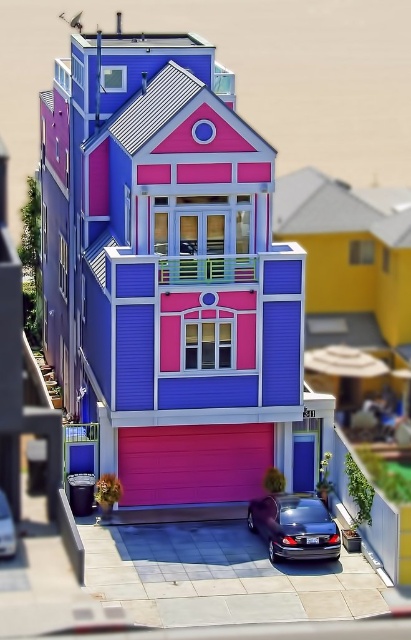
Who is taller, glossy metallic car at lower center or shiny metallic car at lower center?

glossy metallic car at lower center

Who is shorter, glossy metallic car at lower center or shiny metallic car at lower center?

With less height is shiny metallic car at lower center.

What do you see at coordinates (295, 525) in the screenshot?
I see `glossy metallic car at lower center` at bounding box center [295, 525].

The height and width of the screenshot is (640, 411). Find the location of `glossy metallic car at lower center`. glossy metallic car at lower center is located at coordinates (295, 525).